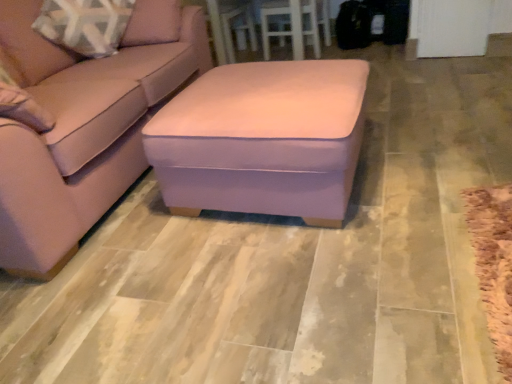
Question: Is white wood table at upper center located outside pink velvet ottoman at center?

Choices:
 (A) yes
 (B) no

Answer: (A)

Question: Is white wood table at upper center wider than pink velvet ottoman at center?

Choices:
 (A) yes
 (B) no

Answer: (B)

Question: From a real-world perspective, does white wood table at upper center stand above pink velvet ottoman at center?

Choices:
 (A) yes
 (B) no

Answer: (A)

Question: Does white wood table at upper center contain pink velvet ottoman at center?

Choices:
 (A) no
 (B) yes

Answer: (A)

Question: Is white wood table at upper center smaller than pink velvet ottoman at center?

Choices:
 (A) no
 (B) yes

Answer: (A)

Question: Is suede pink ottoman at center taller or shorter than pink velvet ottoman at center?

Choices:
 (A) tall
 (B) short

Answer: (A)

Question: Do you think suede pink ottoman at center is within pink velvet ottoman at center, or outside of it?

Choices:
 (A) inside
 (B) outside

Answer: (B)

Question: From a real-world perspective, relative to pink velvet ottoman at center, is suede pink ottoman at center vertically above or below?

Choices:
 (A) above
 (B) below

Answer: (A)

Question: Is suede pink ottoman at center wider or thinner than pink velvet ottoman at center?

Choices:
 (A) thin
 (B) wide

Answer: (B)

Question: Based on their positions, is suede pink ottoman at center located to the left or right of white wood table at upper center?

Choices:
 (A) left
 (B) right

Answer: (A)

Question: Is point click(x=197, y=66) closer or farther from the camera than point click(x=210, y=8)?

Choices:
 (A) closer
 (B) farther

Answer: (A)

Question: From their relative heights in the image, would you say suede pink ottoman at center is taller or shorter than white wood table at upper center?

Choices:
 (A) short
 (B) tall

Answer: (B)

Question: Is suede pink ottoman at center situated inside white wood table at upper center or outside?

Choices:
 (A) inside
 (B) outside

Answer: (B)

Question: Does point (320, 200) appear closer or farther from the camera than point (211, 6)?

Choices:
 (A) farther
 (B) closer

Answer: (B)

Question: From a real-world perspective, relative to white wood table at upper center, is pink velvet ottoman at center vertically above or below?

Choices:
 (A) above
 (B) below

Answer: (B)